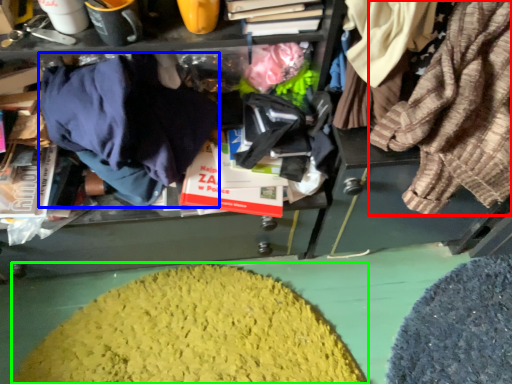
Question: Based on their relative distances, which object is nearer to clothing (highlighted by a red box)? Choose from clothing (highlighted by a blue box) and debris (highlighted by a green box).

Choices:
 (A) clothing
 (B) debris

Answer: (A)